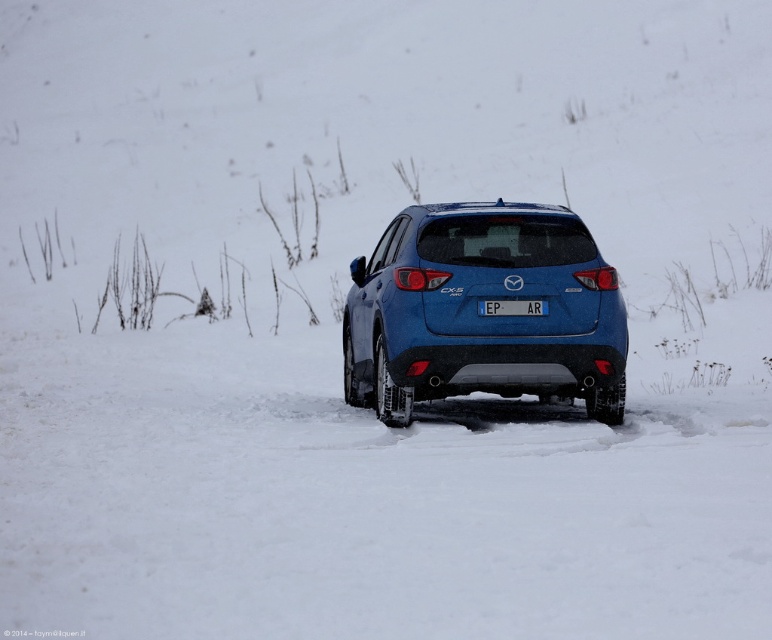
Question: Where is blue matte suv at center located in relation to white plastic license plate at center in the image?

Choices:
 (A) right
 (B) left

Answer: (B)

Question: Is blue matte suv at center positioned behind white plastic license plate at center?

Choices:
 (A) yes
 (B) no

Answer: (B)

Question: Is blue matte suv at center bigger than white plastic license plate at center?

Choices:
 (A) yes
 (B) no

Answer: (A)

Question: Which object is closer to the camera taking this photo?

Choices:
 (A) white plastic license plate at center
 (B) blue matte suv at center

Answer: (B)

Question: Which point is farther to the camera?

Choices:
 (A) (530, 214)
 (B) (513, 316)

Answer: (A)